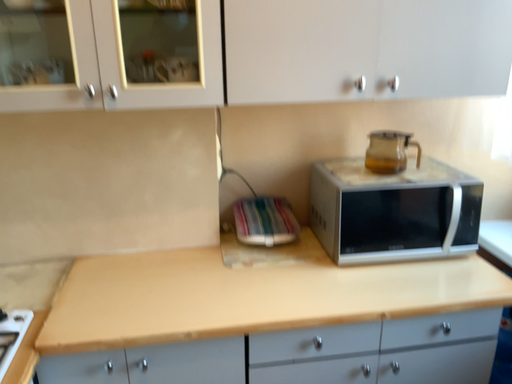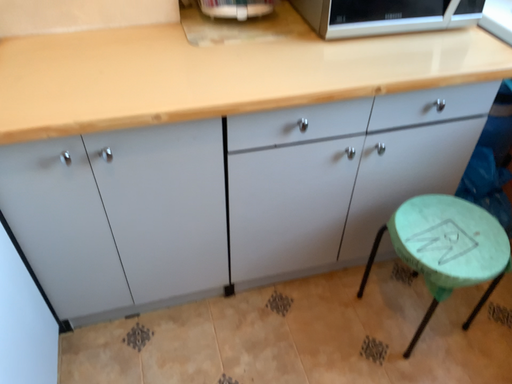
Question: Which way did the camera rotate in the video?

Choices:
 (A) rotated upward
 (B) rotated downward

Answer: (B)